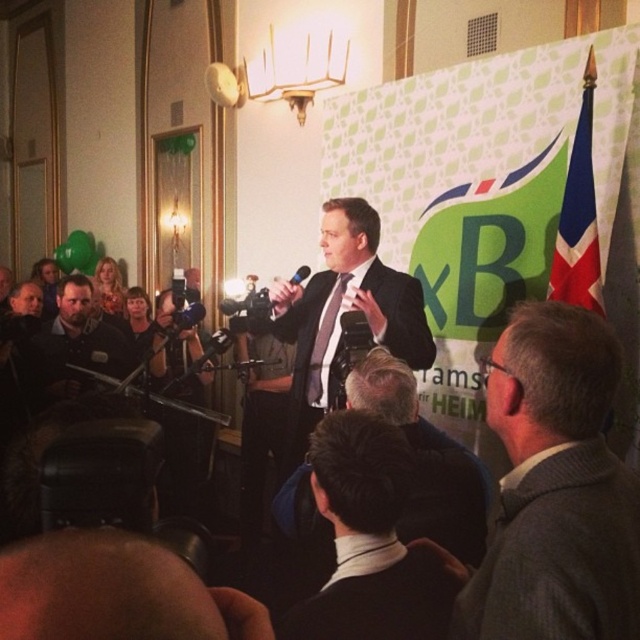
You are an event organizer who needs to determine seating arrangements based on the attendees clothing. You see the gray wool suit at center and the matte black jacket at upper left. Which one has a narrower width?

The gray wool suit at center is thinner than matte black jacket at upper left, so the gray wool suit at center has a narrower width.

You are a photographer at the event and need to capture a photo of both the matte black suit at center and the dark gray shirt at left. The camera you have can focus on subjects within a 5 feet range. Will you be able to capture both in one shot?

The matte black suit at center and the dark gray shirt at left are 4.80 feet apart, so yes, the camera can focus on both subjects since the distance between them is within the 5 feet range.

You are a photographer standing at the front of the room. You want to take a closeup shot of the gray wool suit at center. The optimal focus distance for your camera is 30 inches. Can you move closer to get a better shot without stepping into the frame?

The gray wool suit at center is currently 34.05 inches away from the camera. Since the optimal focus distance is 30 inches, you need to move 4.05 inches closer to achieve the best focus without stepping into the frame.